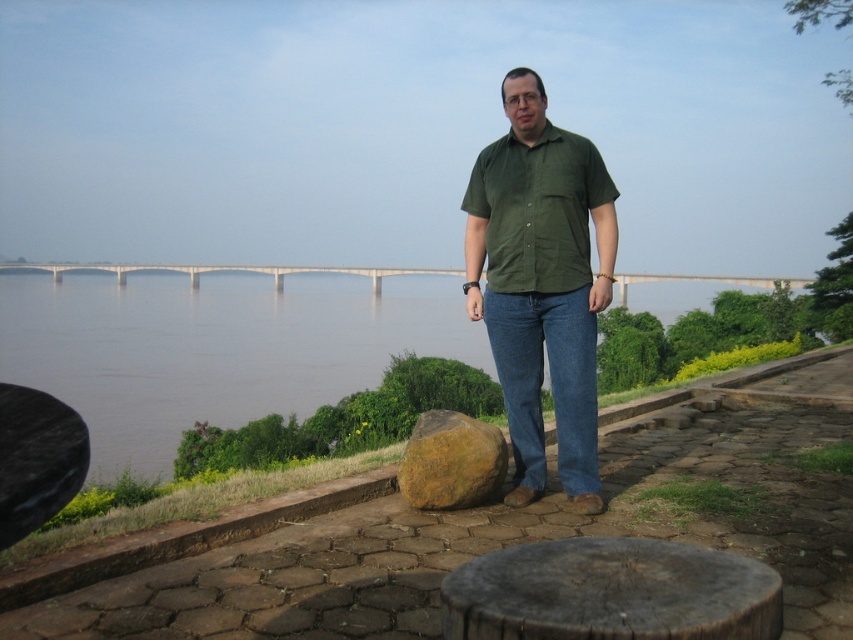
You are standing at the point marked by the coordinates point (x=610, y=593). You want to move towards the large rock near the man s feet. Is the large rock located to your left or right side?

The point (x=610, y=593) marks the dark brown wood stool at lower center. The large rock is near the man s feet, which are in front of him. Since the man is facing forward, the large rock would be directly in front of the dark brown wood stool at lower center. Therefore, if you are standing at the point (x=610, y=593), the large rock is in front of you, not to your left or right side.

You are a photographer setting up equipment for a portrait. You have a dark brown wood stool at lower center and a brown rough rock at center. Which object should you place your camera bag on to keep it out of the shot? Explain your choice based on their positions.

The dark brown wood stool at lower center is to the right of the brown rough rock at center. Since the stool is positioned further to the right, placing the camera bag on it would keep it out of the frame if the shot focuses on the rock area.

You are a photographer trying to capture a shot of the brown muddy water at center and the green cotton shirt at center. Which object is located to the left of the other?

The brown muddy water at center is positioned on the left side of green cotton shirt at center.